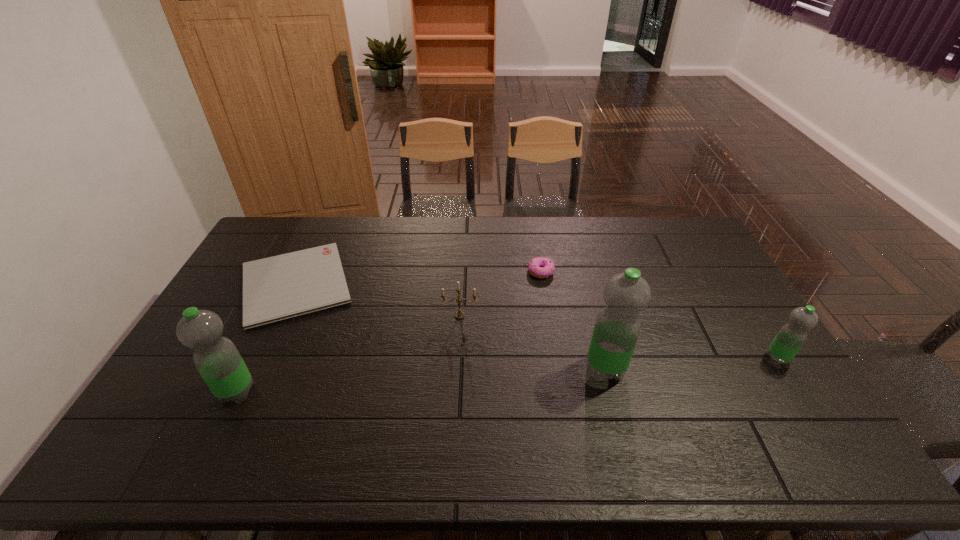
The height and width of the screenshot is (540, 960). I want to click on vacant space located 0.130m on the right of the leftmost water bottle, so click(304, 392).

Find the location of a particular element. Image resolution: width=960 pixels, height=540 pixels. vacant space located 0.210m on the left of the fifth object from left to right is located at coordinates (510, 369).

Where is `free space located 0.150m on the left of the rightmost water bottle`? This screenshot has height=540, width=960. free space located 0.150m on the left of the rightmost water bottle is located at coordinates (713, 358).

Locate an element on the screen. The width and height of the screenshot is (960, 540). free space located on the front of the second shortest object is located at coordinates (550, 328).

In order to click on vacant space located on the right of the shortest object in this screenshot , I will do `click(432, 284)`.

Where is `vacant point located on the front of the third object from left to right`? This screenshot has height=540, width=960. vacant point located on the front of the third object from left to right is located at coordinates (457, 372).

In order to click on object located in the far edge section of the desktop in this screenshot , I will do `click(280, 287)`.

The width and height of the screenshot is (960, 540). What are the coordinates of `object positioned at the near edge` in the screenshot? It's located at (x=217, y=359).

Image resolution: width=960 pixels, height=540 pixels. What are the coordinates of `water bottle positioned at the left edge` in the screenshot? It's located at (217, 359).

Find the location of a particular element. The height and width of the screenshot is (540, 960). clipboard located in the left edge section of the desktop is located at coordinates (280, 287).